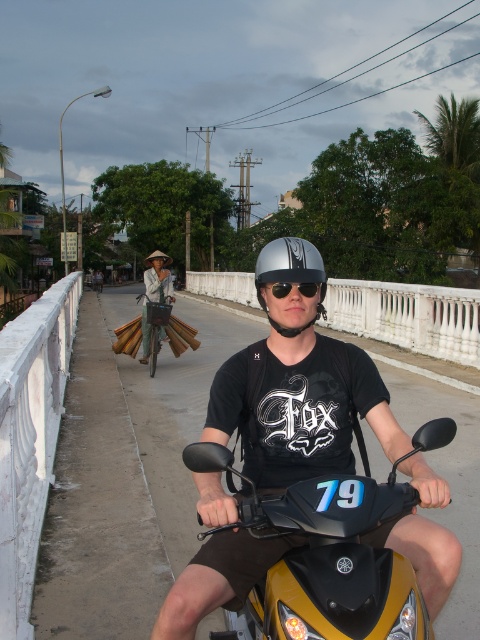
Between silver metallic helmet at center and brown woven basket at center, which one appears on the right side from the viewer's perspective?

silver metallic helmet at center

Find the location of `silver metallic helmet at center`. silver metallic helmet at center is located at coordinates (288, 269).

Between point (312, 244) and point (159, 266), which one is positioned behind?

The point (312, 244) is behind.

I want to click on silver metallic helmet at center, so click(x=288, y=269).

Which of these two, silver metallic helmet at center or sunglasses at center, stands taller?

silver metallic helmet at center is taller.

Does silver metallic helmet at center appear on the right side of sunglasses at center?

Yes, silver metallic helmet at center is to the right of sunglasses at center.

Where is `silver metallic helmet at center`? silver metallic helmet at center is located at coordinates (288, 269).

Consider the image. Who is lower down, matte black helmet at center or silver metallic helmet at center?

matte black helmet at center is below.

Who is more forward, (360, 410) or (276, 241)?

Point (360, 410) is more forward.

Is point (289, 435) positioned in front of point (284, 246)?

That is True.

In order to click on matte black helmet at center in this screenshot , I will do `click(298, 385)`.